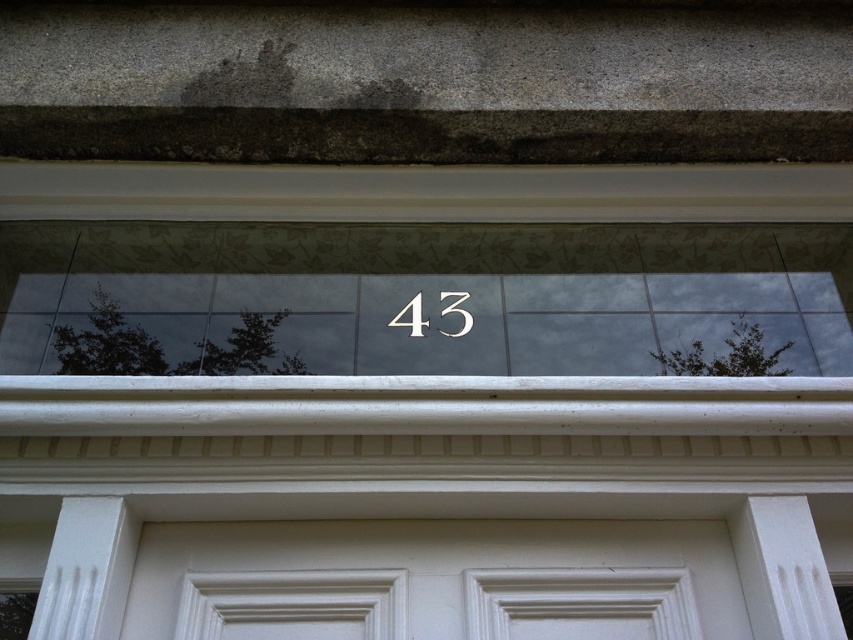
Looking at this image, does transparent glass at center have a lesser height compared to black metallic number at center?

Incorrect, transparent glass at center's height does not fall short of black metallic number at center's.

This screenshot has width=853, height=640. Describe the element at coordinates (424, 298) in the screenshot. I see `transparent glass at center` at that location.

You are a GUI agent. You are given a task and a screenshot of the screen. Output one action in this format:
    pyautogui.click(x=<x>, y=<y>)
    Task: Click on the transparent glass at center
    This screenshot has height=640, width=853.
    Given the screenshot: What is the action you would take?
    click(424, 298)

Identify the location of transparent glass at center. (424, 298).